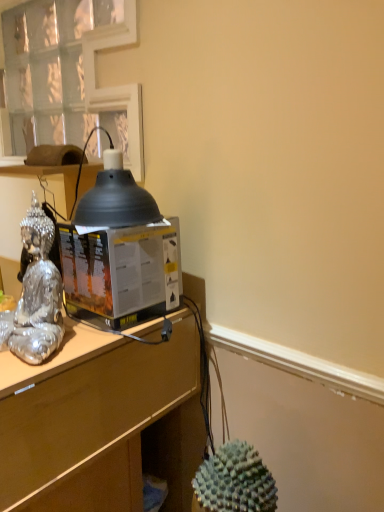
This screenshot has height=512, width=384. Find the location of `transparent plastic desktop computer at center`. transparent plastic desktop computer at center is located at coordinates (121, 273).

What do you see at coordinates (67, 78) in the screenshot? The height and width of the screenshot is (512, 384). I see `clear glass window at upper left` at bounding box center [67, 78].

What are the coordinates of `matte black lampshade at upper center` in the screenshot? It's located at (114, 196).

Locate an element on the screen. The width and height of the screenshot is (384, 512). silver reflective statue at left is located at coordinates (36, 295).

What is the approximate height of brown matte desk at center?

brown matte desk at center is 9.02 inches in height.

In order to face brown matte desk at center, should I rotate leftwards or rightwards?

Rotate your view left by about 24.078°.

The width and height of the screenshot is (384, 512). In order to click on transparent plastic desktop computer at center in this screenshot , I will do `click(121, 273)`.

Would you say matte black lampshade at upper left is part of matte black lampshade at upper center's contents?

Definitely not — matte black lampshade at upper left is not inside matte black lampshade at upper center.

Does point (103, 207) come farther from viewer compared to point (20, 165)?

That is False.

Is matte black lampshade at upper center bigger than matte black lampshade at upper left?

Actually, matte black lampshade at upper center might be smaller than matte black lampshade at upper left.

How much distance is there between matte black lampshade at upper center and transparent plastic desktop computer at center?

matte black lampshade at upper center and transparent plastic desktop computer at center are 4.39 inches apart from each other.

Is matte black lampshade at upper center smaller than transparent plastic desktop computer at center?

Indeed, matte black lampshade at upper center has a smaller size compared to transparent plastic desktop computer at center.

Can you tell me how much matte black lampshade at upper center and transparent plastic desktop computer at center differ in facing direction?

There is a 1.82-degree angle between the facing directions of matte black lampshade at upper center and transparent plastic desktop computer at center.

Can you confirm if matte black lampshade at upper center is taller than transparent plastic desktop computer at center?

Incorrect, the height of matte black lampshade at upper center is not larger of that of transparent plastic desktop computer at center.

Between silver reflective statue at left and clear glass window at upper left, which one has more height?

clear glass window at upper left is taller.

From the image's perspective, which object appears higher, silver reflective statue at left or clear glass window at upper left?

clear glass window at upper left appears higher in the image.

Can you confirm if silver reflective statue at left is smaller than clear glass window at upper left?

Yes.

Which object is wider, silver reflective statue at left or clear glass window at upper left?

Wider between the two is clear glass window at upper left.

You are a GUI agent. You are given a task and a screenshot of the screen. Output one action in this format:
    pyautogui.click(x=<x>, y=<y>)
    Task: Click on the window behind the brown matte desk at center
    
    Given the screenshot: What is the action you would take?
    pyautogui.click(x=67, y=78)

Is clear glass window at upper left far away from brown matte desk at center?

That's not correct — clear glass window at upper left is a little close to brown matte desk at center.

Can we say clear glass window at upper left lies outside brown matte desk at center?

clear glass window at upper left lies outside brown matte desk at center's area.

In the scene shown: How far apart are clear glass window at upper left and brown matte desk at center?

32.78 inches.

Does point (105, 272) come farther from viewer compared to point (56, 277)?

Yes, point (105, 272) is farther from viewer.

Could you tell me if transparent plastic desktop computer at center is facing silver reflective statue at left?

Yes, transparent plastic desktop computer at center is oriented towards silver reflective statue at left.

Are transparent plastic desktop computer at center and silver reflective statue at left making contact?

They are not placed beside each other.

Who is bigger, transparent plastic desktop computer at center or silver reflective statue at left?

transparent plastic desktop computer at center.

From a real-world perspective, between brown matte desk at center and transparent plastic desktop computer at center, who is vertically higher?

transparent plastic desktop computer at center, from a real-world perspective.

Is brown matte desk at center looking in the opposite direction of transparent plastic desktop computer at center?

No, transparent plastic desktop computer at center is not at the back of brown matte desk at center.

Are brown matte desk at center and transparent plastic desktop computer at center located far from each other?

No.

Is there a large distance between transparent plastic desktop computer at center and matte black lampshade at upper center?

transparent plastic desktop computer at center is actually quite close to matte black lampshade at upper center.

Would you say transparent plastic desktop computer at center is inside or outside matte black lampshade at upper center?

transparent plastic desktop computer at center is not inside matte black lampshade at upper center, it's outside.

Is transparent plastic desktop computer at center wider than matte black lampshade at upper center?

Yes.

Does transparent plastic desktop computer at center have a larger size compared to matte black lampshade at upper center?

Yes.

Image resolution: width=384 pixels, height=512 pixels. Identify the location of vanity that is under the matte black lampshade at upper center (from a real-world perspective). (30, 199).

Find the location of `desktop computer behind the matte black lampshade at upper center`. desktop computer behind the matte black lampshade at upper center is located at coordinates (121, 273).

In the scene shown: Based on their spatial positions, is clear glass window at upper left or matte black lampshade at upper center closer to silver reflective statue at left?

matte black lampshade at upper center lies closer to silver reflective statue at left than the other object.

Estimate the real-world distances between objects in this image. Which object is closer to matte black lampshade at upper left, transparent plastic desktop computer at center or clear glass window at upper left?

clear glass window at upper left is positioned closer to the anchor matte black lampshade at upper left.

When comparing their distances from clear glass window at upper left, does matte black lampshade at upper left or silver reflective statue at left seem further?

silver reflective statue at left is positioned further to the anchor clear glass window at upper left.

Considering their positions, is transparent plastic desktop computer at center positioned further to matte black lampshade at upper left than brown matte desk at center?

Based on the image, brown matte desk at center appears to be further to matte black lampshade at upper left.

Based on their spatial positions, is brown matte desk at center or clear glass window at upper left further from transparent plastic desktop computer at center?

The object further to transparent plastic desktop computer at center is clear glass window at upper left.

Which object lies further to the anchor point clear glass window at upper left, transparent plastic desktop computer at center or matte black lampshade at upper left?

Among the two, transparent plastic desktop computer at center is located further to clear glass window at upper left.

Looking at the image, which one is located further to brown matte desk at center, clear glass window at upper left or silver reflective statue at left?

clear glass window at upper left lies further to brown matte desk at center than the other object.

Based on their spatial positions, is matte black lampshade at upper center or clear glass window at upper left closer to matte black lampshade at upper left?

clear glass window at upper left.

The width and height of the screenshot is (384, 512). Identify the location of desktop computer between clear glass window at upper left and brown matte desk at center from top to bottom. (121, 273).

Identify the location of desktop computer between brown matte desk at center and matte black lampshade at upper center in the horizontal direction. [x=121, y=273].

Where is `desktop computer between matte black lampshade at upper center and silver reflective statue at left in the vertical direction`? The height and width of the screenshot is (512, 384). desktop computer between matte black lampshade at upper center and silver reflective statue at left in the vertical direction is located at coordinates (121, 273).

Locate an element on the screen. The image size is (384, 512). lamp between clear glass window at upper left and silver reflective statue at left from top to bottom is located at coordinates (114, 196).